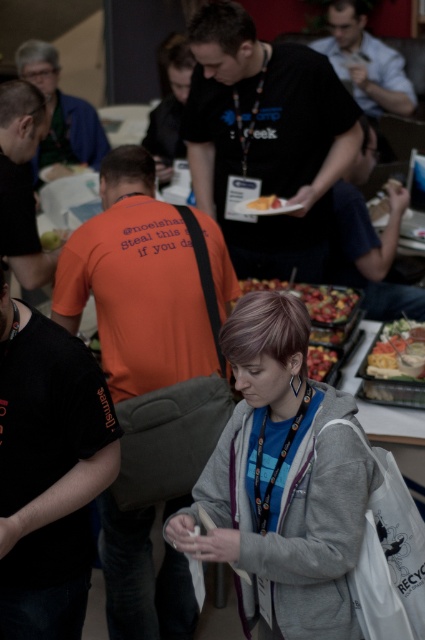
You are a service robot at the event. You need to deliver a drink to the gray fleece jacket at center, but there is a white plastic tray at center in the way. Can you navigate around the tray to reach your destination?

The distance between the gray fleece jacket at center and the white plastic tray at center is 91.84 centimeters. Since the tray is in the way, the robot should be able to navigate around it as the space allows for maneuvering around the tray to reach the destination.

You are a photographer at the event and want to capture a clear shot of both the gray fleece jacket at center and the white plastic tray at center. Since you can only focus on one object at a time, which one should you focus on to ensure the other is still somewhat in focus?

Result: You should focus on the gray fleece jacket at center because it is closer to the viewer than the white plastic tray at center. By focusing on the closer object, the depth of field may still keep the farther object somewhat in focus.

What is the relationship between the gray fleece jacket at center and the smooth plastic tray at center in terms of their vertical positioning?

The gray fleece jacket at center is positioned under the smooth plastic tray at center, meaning the tray is above the jacket vertically.